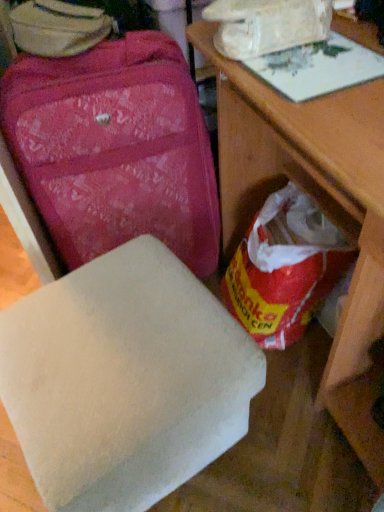
Question: Considering the relative positions of wooden table at center and white matte foam at lower center in the image provided, is wooden table at center to the right of white matte foam at lower center from the viewer's perspective?

Choices:
 (A) yes
 (B) no

Answer: (A)

Question: Does wooden table at center have a greater height compared to white matte foam at lower center?

Choices:
 (A) no
 (B) yes

Answer: (B)

Question: Can you confirm if wooden table at center is wider than white matte foam at lower center?

Choices:
 (A) yes
 (B) no

Answer: (A)

Question: Is white matte foam at lower center inside wooden table at center?

Choices:
 (A) yes
 (B) no

Answer: (B)

Question: From a real-world perspective, is wooden table at center on top of white matte foam at lower center?

Choices:
 (A) no
 (B) yes

Answer: (B)

Question: Does wooden table at center appear on the left side of white matte foam at lower center?

Choices:
 (A) no
 (B) yes

Answer: (A)

Question: Considering the relative sizes of white matte foam at lower center and red plastic grocery bag at lower right in the image provided, is white matte foam at lower center smaller than red plastic grocery bag at lower right?

Choices:
 (A) no
 (B) yes

Answer: (A)

Question: From a real-world perspective, is white matte foam at lower center beneath red plastic grocery bag at lower right?

Choices:
 (A) no
 (B) yes

Answer: (A)

Question: Can you confirm if white matte foam at lower center is bigger than red plastic grocery bag at lower right?

Choices:
 (A) yes
 (B) no

Answer: (A)

Question: Would you consider white matte foam at lower center to be distant from red plastic grocery bag at lower right?

Choices:
 (A) no
 (B) yes

Answer: (A)

Question: Does white matte foam at lower center have a lesser width compared to red plastic grocery bag at lower right?

Choices:
 (A) no
 (B) yes

Answer: (A)

Question: Is white matte foam at lower center shorter than red plastic grocery bag at lower right?

Choices:
 (A) no
 (B) yes

Answer: (A)

Question: Is matte pink suitcase at upper left located within red plastic grocery bag at lower right?

Choices:
 (A) no
 (B) yes

Answer: (A)